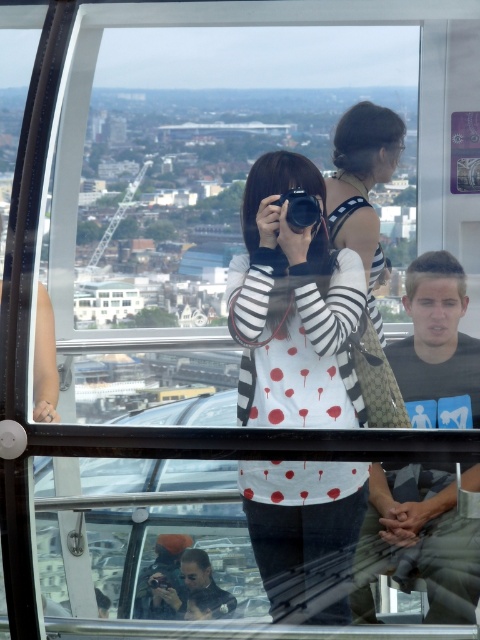
Question: Which point appears closest to the camera in this image?

Choices:
 (A) (299, 209)
 (B) (302, 556)
 (C) (395, 516)

Answer: (A)

Question: Does black matte shirt at center come behind black plastic camera at center?

Choices:
 (A) yes
 (B) no

Answer: (A)

Question: Among these points, which one is nearest to the camera?

Choices:
 (A) (345, 595)
 (B) (309, 202)

Answer: (B)

Question: Does white striped shirt at center appear under black plastic camera at center?

Choices:
 (A) no
 (B) yes

Answer: (B)

Question: Which object is the closest to the black plastic camera at center?

Choices:
 (A) black matte shirt at center
 (B) white striped shirt at center

Answer: (B)

Question: Is the position of black matte shirt at center less distant than that of black plastic camera at center?

Choices:
 (A) no
 (B) yes

Answer: (A)